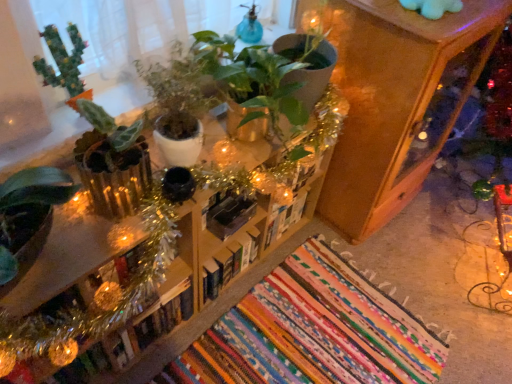
The width and height of the screenshot is (512, 384). What are the coordinates of `empty space that is to the right of hardcover book at center, the first book in the left-to-right sequence` in the screenshot? It's located at (210, 331).